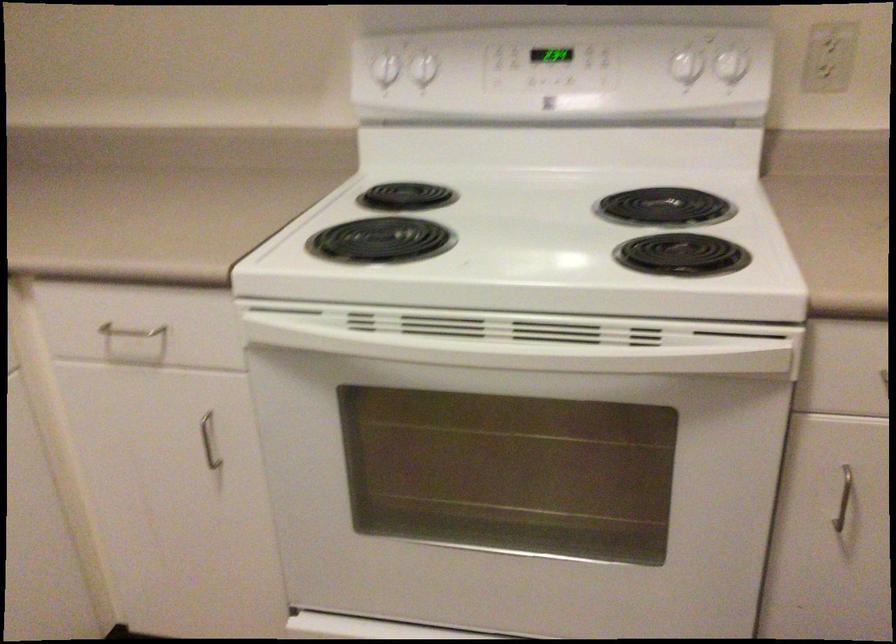
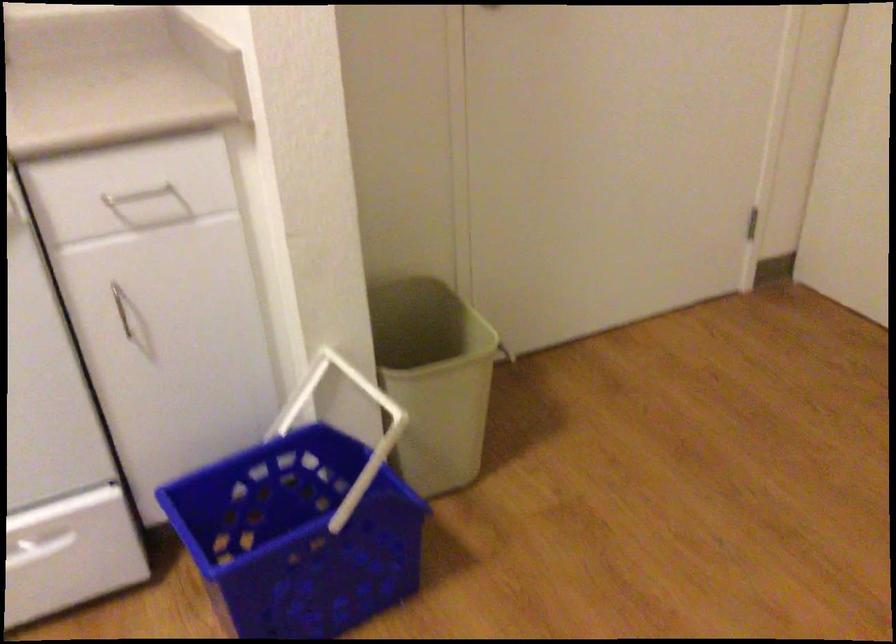
Question: Based on the continuous images, in which direction is the camera rotating? Reply with the corresponding letter.

Choices:
 (A) Left
 (B) Right
 (C) Up
 (D) Down

Answer: (B)